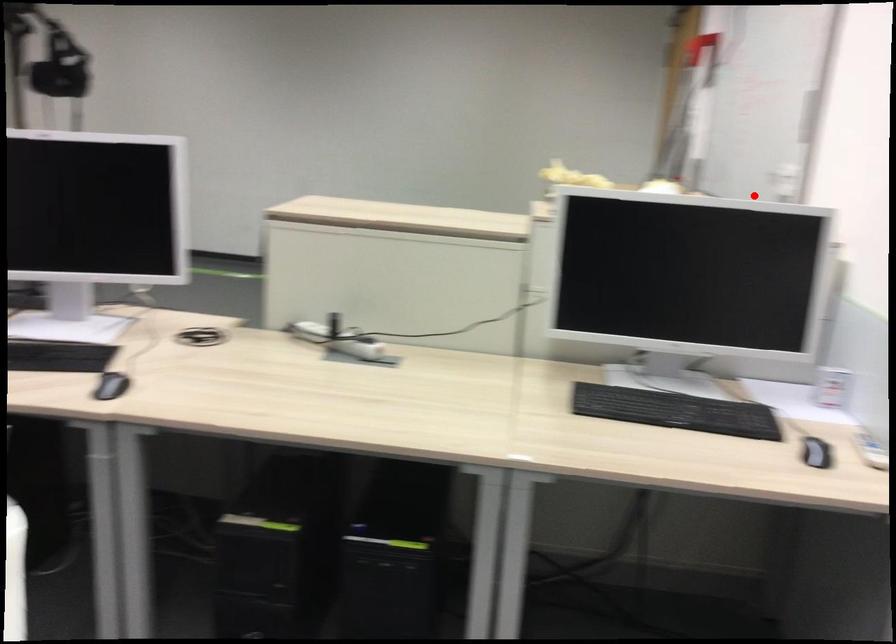
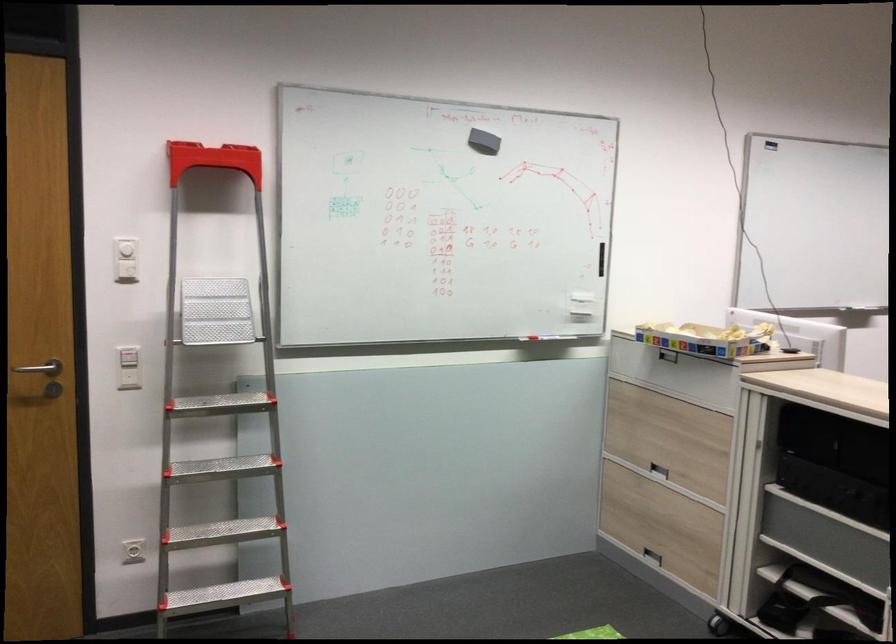
Question: I am providing you with two images of the same scene from different viewpoints. Image1 has a red point marked. In image2, the corresponding 3D location appears at what relative position? Reply with the corresponding letter.

Choices:
 (A) Closer
 (B) Farther

Answer: (B)